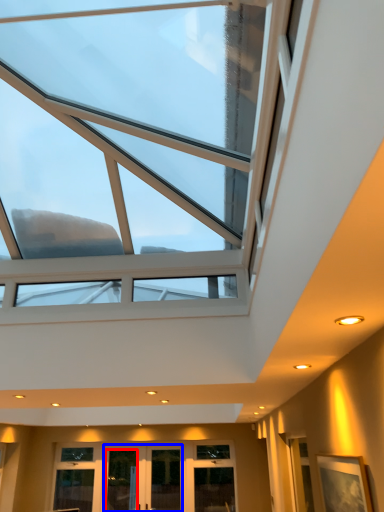
Question: Among these objects, which one is farthest to the camera, glass door (highlighted by a red box) or glass door (highlighted by a blue box)?

Choices:
 (A) glass door
 (B) glass door

Answer: (A)